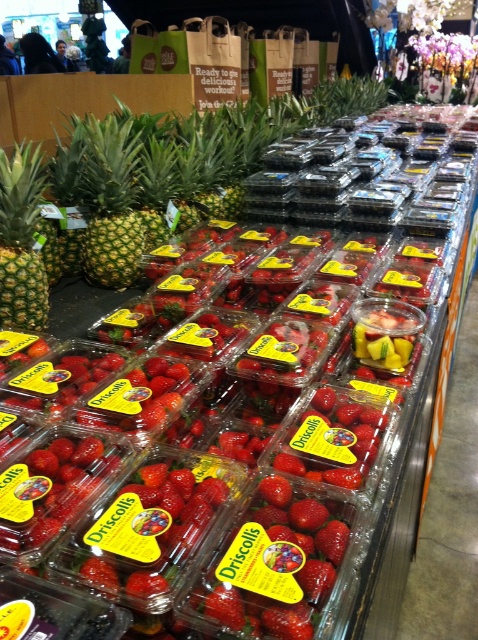
Question: Among these objects, which one is farthest from the camera?

Choices:
 (A) green rough pineapple at left
 (B) green matte pineapple at left

Answer: (B)

Question: Which of the following is the farthest from the observer?

Choices:
 (A) green rough pineapple at left
 (B) green matte pineapple at left

Answer: (B)

Question: Does green matte pineapple at left lie in front of green rough pineapple at left?

Choices:
 (A) no
 (B) yes

Answer: (A)

Question: Does green matte pineapple at left appear on the right side of green rough pineapple at left?

Choices:
 (A) no
 (B) yes

Answer: (B)

Question: Is green matte pineapple at left bigger than green rough pineapple at left?

Choices:
 (A) no
 (B) yes

Answer: (B)